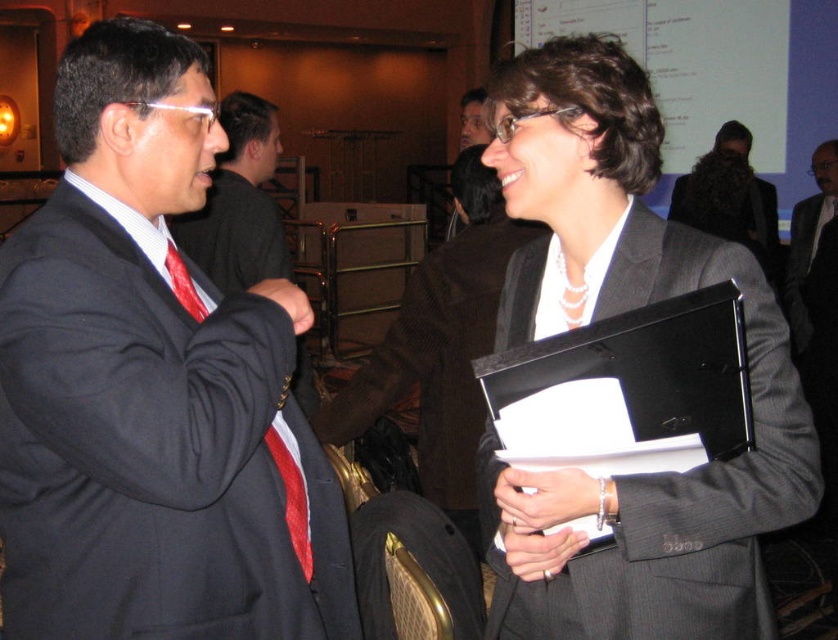
Question: Does red striped tie at left appear over red silk tie at left?

Choices:
 (A) yes
 (B) no

Answer: (B)

Question: Which is nearer to the matte black suit at left?

Choices:
 (A) red striped tie at left
 (B) gray pinstripe suit at upper right
 (C) dark brown wool suit at center

Answer: (A)

Question: Does matte black suit at left appear on the left side of gray pinstripe suit at upper right?

Choices:
 (A) yes
 (B) no

Answer: (A)

Question: Is red striped tie at left to the right of red silk tie at left from the viewer's perspective?

Choices:
 (A) no
 (B) yes

Answer: (B)

Question: Which object appears farthest from the camera in this image?

Choices:
 (A) dark brown wool suit at center
 (B) gray pinstripe suit at upper right

Answer: (A)

Question: Which object is closer to the camera taking this photo?

Choices:
 (A) matte black suit at left
 (B) red silk tie at left

Answer: (A)